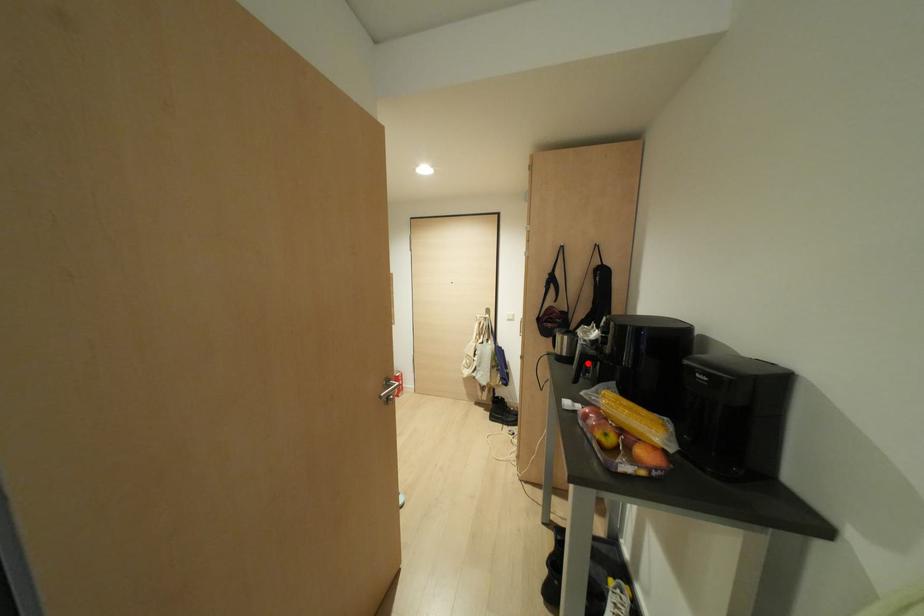
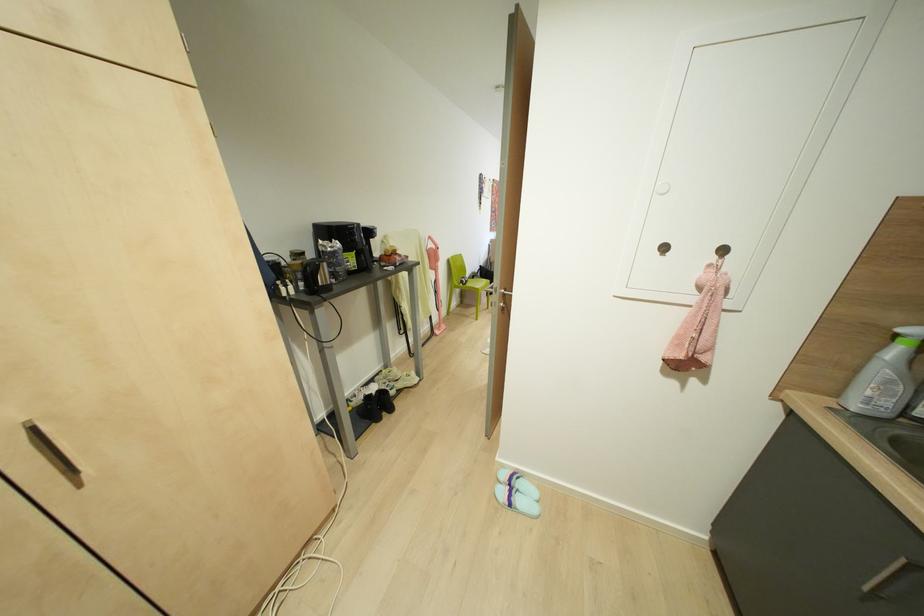
Question: I am providing you with two images of the same scene from different viewpoints. A red point is marked on the first image. At the location where the point appears in image 1, is it still visible in image 2?

Choices:
 (A) Yes
 (B) No

Answer: (B)